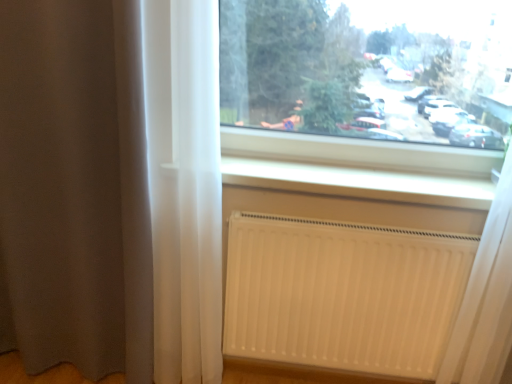
Identify the location of vacant region above white matte radiator at lower right (from a real-world perspective). Image resolution: width=512 pixels, height=384 pixels. (355, 225).